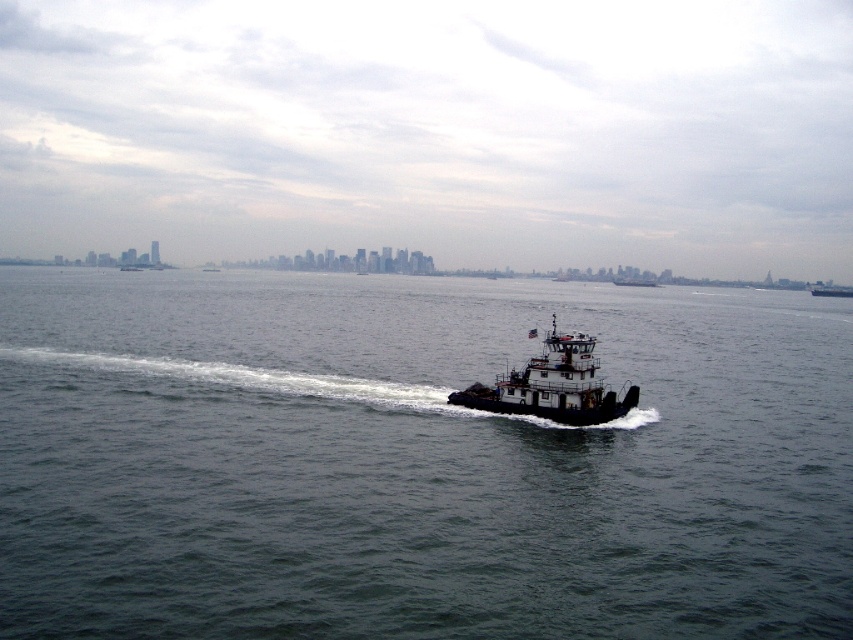
Question: Does dark gray water at center have a larger size compared to metallic gray tugboat at center?

Choices:
 (A) no
 (B) yes

Answer: (B)

Question: Is black matte tugboat at center positioned in front of dark gray metallic tugboat at center?

Choices:
 (A) no
 (B) yes

Answer: (B)

Question: Which of the following is the farthest from the observer?

Choices:
 (A) metallic gray tugboat at center
 (B) dark gray metallic tugboat at center

Answer: (A)

Question: Which is nearer to the dark gray water at center?

Choices:
 (A) black matte tugboat at center
 (B) dark gray metallic tugboat at center
 (C) metallic gray tugboat at center

Answer: (A)

Question: Which point is farther from the camera taking this photo?

Choices:
 (A) (819, 291)
 (B) (525, 371)

Answer: (A)

Question: Is dark gray water at center thinner than metallic gray tugboat at center?

Choices:
 (A) yes
 (B) no

Answer: (B)